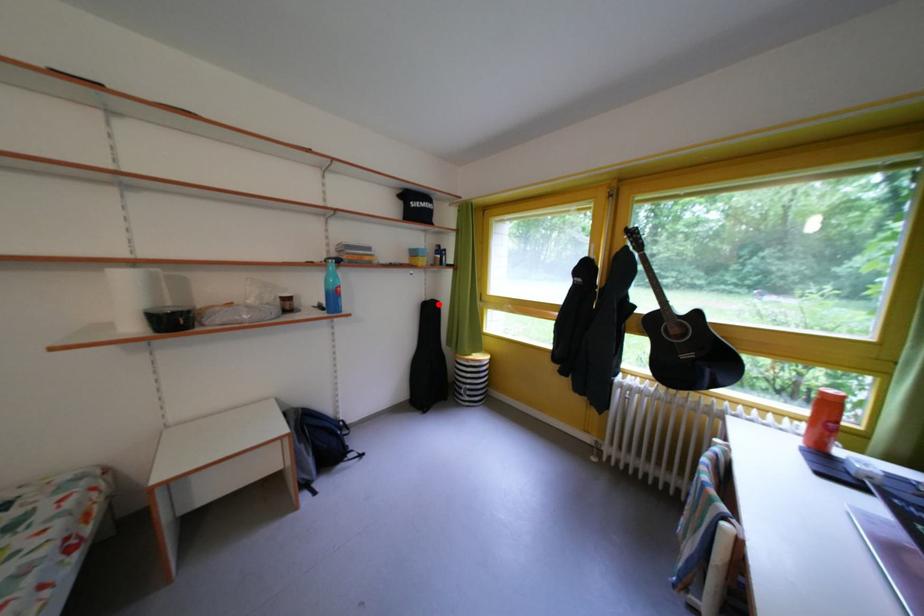
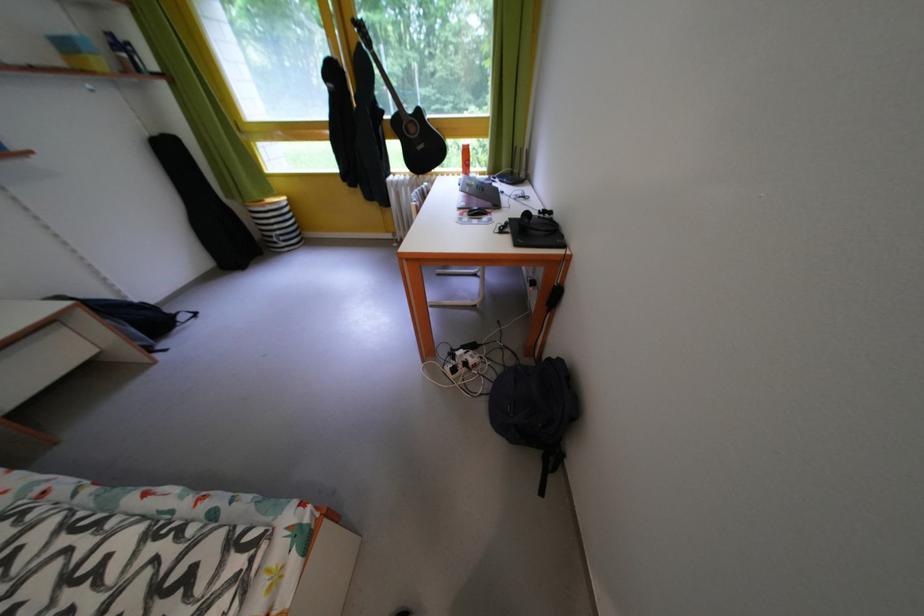
The point at the highlighted location is marked in the first image. Where is the corresponding point in the second image?

(165, 139)